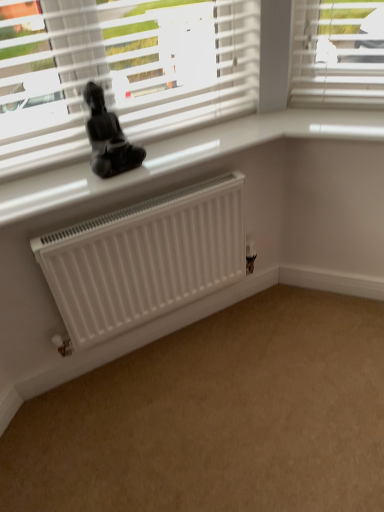
Locate an element on the screen. Image resolution: width=384 pixels, height=512 pixels. vacant area that is in front of black glossy statue at upper center is located at coordinates (96, 183).